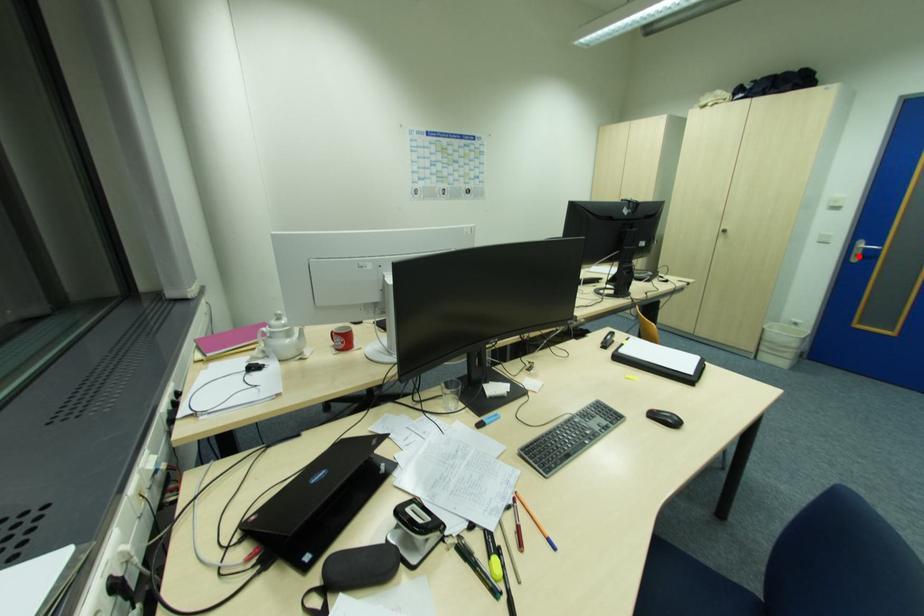
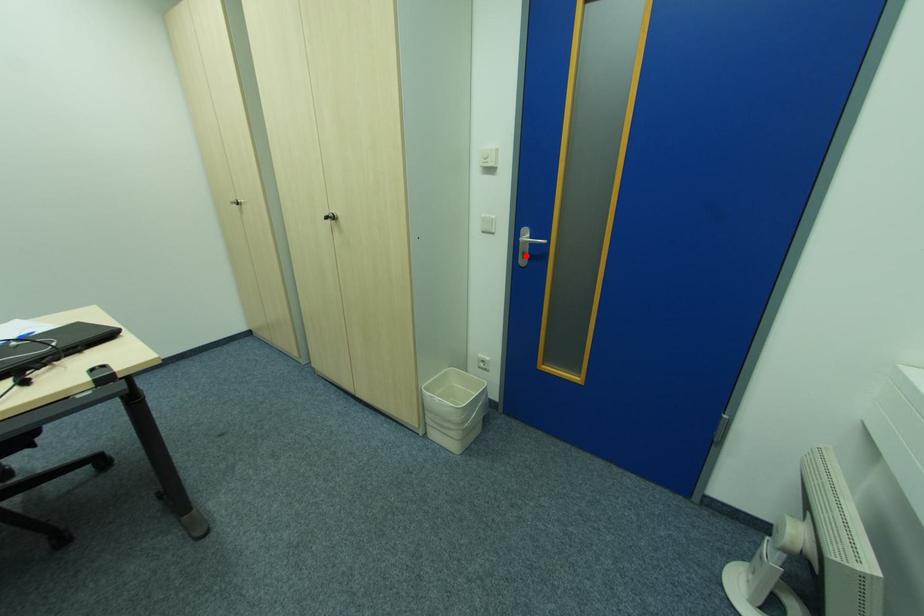
I am providing you with two images of the same scene from different viewpoints. A red point is marked on the first image and another point is marked on the second image. Do the highlighted points in image1 and image2 indicate the same real-world spot?

Yes